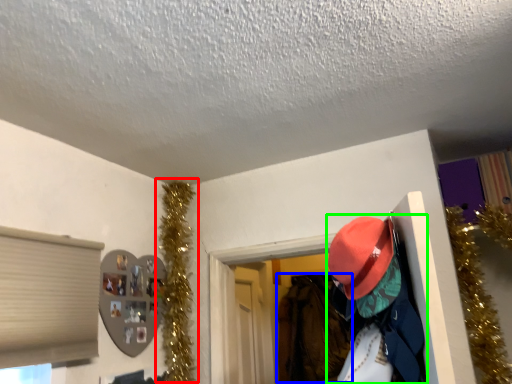
Question: Considering the real-world distances, which object is closest to christmas decoration (highlighted by a red box)? clothing (highlighted by a blue box) or person (highlighted by a green box).

Choices:
 (A) clothing
 (B) person

Answer: (B)